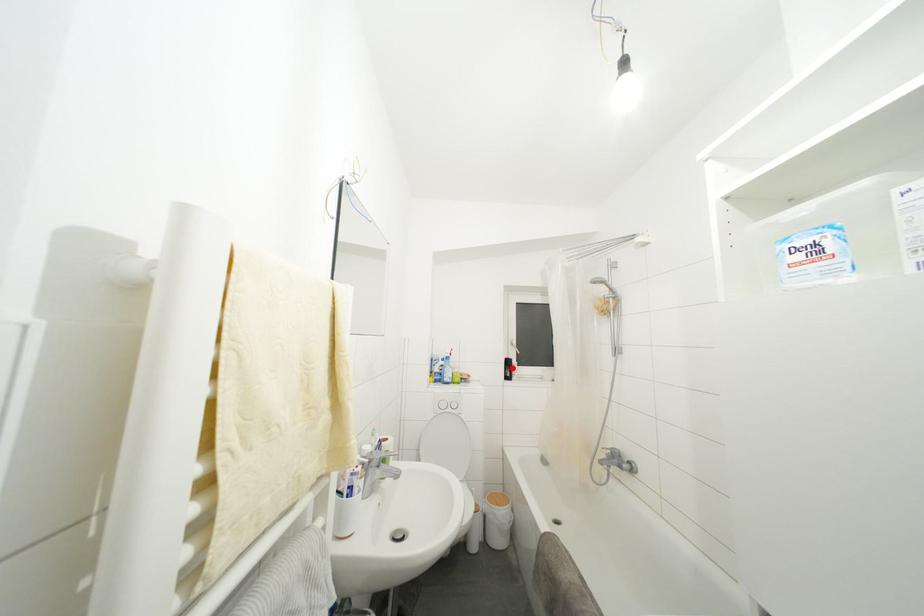
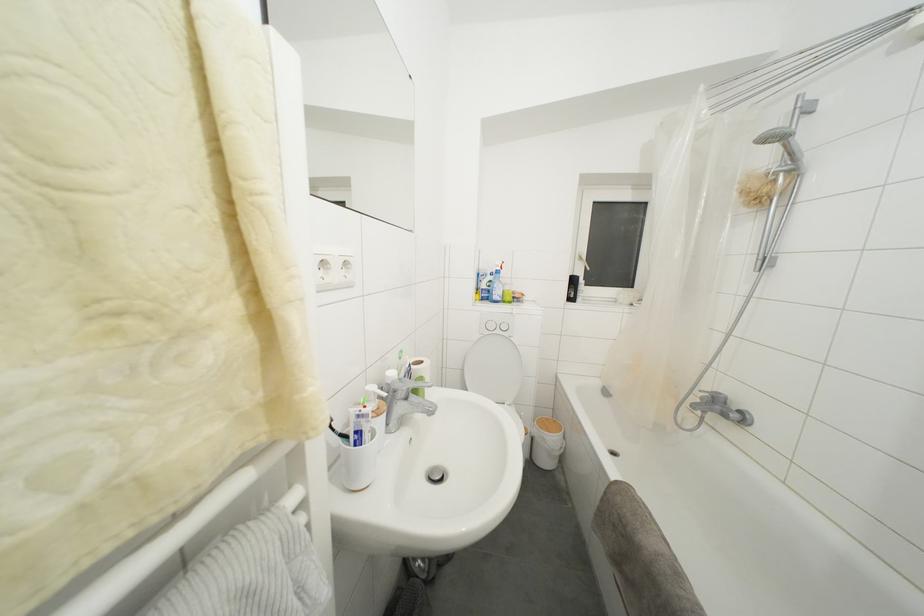
Question: I am providing you with two images of the same scene from different viewpoints. A red point is shown in image1. For the corresponding object point in image2, is it positioned nearer or farther from the camera?

Choices:
 (A) Nearer
 (B) Farther

Answer: (A)